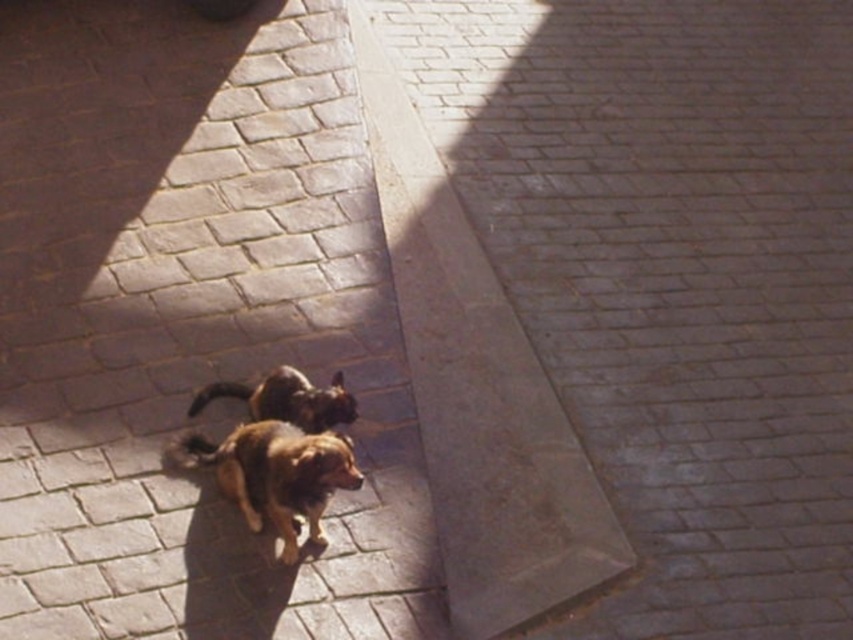
Does gray brick pavement at lower left appear on the left side of brown furry dog at center?

In fact, gray brick pavement at lower left is to the right of brown furry dog at center.

Describe the element at coordinates (672, 276) in the screenshot. I see `gray brick pavement at lower left` at that location.

Which is behind, point (744, 532) or point (347, 410)?

The point (744, 532) is more distant.

This screenshot has height=640, width=853. What are the coordinates of `gray brick pavement at lower left` in the screenshot? It's located at (672, 276).

Is gray brick pavement at lower left above brown fur dog at center?

Yes, gray brick pavement at lower left is above brown fur dog at center.

Identify the location of gray brick pavement at lower left. The height and width of the screenshot is (640, 853). (672, 276).

Between brick pavement at center and brown fur dog at center, which one appears on the left side from the viewer's perspective?

brick pavement at center

Is brick pavement at center wider than brown fur dog at center?

Yes.

Is point (167, 109) more distant than point (244, 486)?

Yes, point (167, 109) is behind point (244, 486).

Where is `brick pavement at center`? The width and height of the screenshot is (853, 640). brick pavement at center is located at coordinates (190, 323).